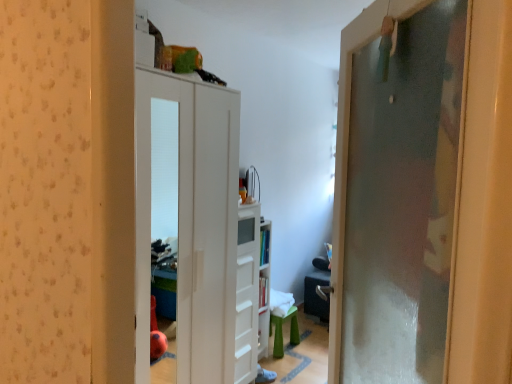
This screenshot has height=384, width=512. Identify the location of white matte cabinet at center, the second door in the front-to-back sequence. (191, 218).

Where is `frosted glass door at right, the 1th door in the right-to-left sequence`? The image size is (512, 384). frosted glass door at right, the 1th door in the right-to-left sequence is located at coordinates (397, 199).

Locate an element on the screen. white plastic bookshelf at center is located at coordinates (264, 288).

From the image's perspective, relative to green plastic stool at lower center, is white glossy dresser at center above or below?

white glossy dresser at center is above green plastic stool at lower center.

In the image, there is a white glossy dresser at center. Where is `furniture below it (from a real-world perspective)`? This screenshot has width=512, height=384. furniture below it (from a real-world perspective) is located at coordinates (282, 331).

Does point (238, 226) come behind point (290, 317)?

No, (238, 226) is in front of (290, 317).

Is white glossy dresser at center in contact with white matte cabinet at center, marked as the 1th door in a left-to-right arrangement?

white glossy dresser at center and white matte cabinet at center, marked as the 1th door in a left-to-right arrangement, are clearly separated.

Between white glossy dresser at center and white matte cabinet at center, the second door viewed from the right, which one has smaller width?

With smaller width is white glossy dresser at center.

Between white glossy dresser at center and white matte cabinet at center, marked as the 1th door in a left-to-right arrangement, which one has larger size?

white matte cabinet at center, marked as the 1th door in a left-to-right arrangement, is bigger.

Is white plastic bookshelf at center inside the boundaries of frosted glass door at right, the second door in the back-to-front sequence, or outside?

white plastic bookshelf at center is spatially situated outside frosted glass door at right, the second door in the back-to-front sequence.

Between white plastic bookshelf at center and frosted glass door at right, the 1th door in the right-to-left sequence, which one has less height?

white plastic bookshelf at center.

Consider the image. How different are the orientations of white plastic bookshelf at center and frosted glass door at right, the second door in the back-to-front sequence, in degrees?

The angular difference between white plastic bookshelf at center and frosted glass door at right, the second door in the back-to-front sequence, is 141 degrees.

Looking at this image, from the image's perspective, is white plastic bookshelf at center located above or below frosted glass door at right, the second door in the back-to-front sequence?

Clearly, from the image's perspective, white plastic bookshelf at center is below frosted glass door at right, the second door in the back-to-front sequence.

Considering the points (245, 284) and (264, 324), which point is behind, point (245, 284) or point (264, 324)?

Positioned behind is point (264, 324).

Can you confirm if white glossy dresser at center is positioned to the left of white plastic bookshelf at center?

Yes.

From a real-world perspective, which object stands above the other?

white glossy dresser at center.

Is white glossy dresser at center not close to white plastic bookshelf at center?

white glossy dresser at center is near white plastic bookshelf at center, not far away.

Can you tell me how much white plastic bookshelf at center and white matte cabinet at center, the second door in the front-to-back sequence, differ in facing direction?

The facing directions of white plastic bookshelf at center and white matte cabinet at center, the second door in the front-to-back sequence, are 1.25 degrees apart.

Considering the relative sizes of white plastic bookshelf at center and white matte cabinet at center, marked as the 1th door in a left-to-right arrangement, in the image provided, is white plastic bookshelf at center shorter than white matte cabinet at center, marked as the 1th door in a left-to-right arrangement,?

Yes.

Considering the relative sizes of white plastic bookshelf at center and white matte cabinet at center, marked as the 1th door in a left-to-right arrangement, in the image provided, is white plastic bookshelf at center wider than white matte cabinet at center, marked as the 1th door in a left-to-right arrangement,?

No, white plastic bookshelf at center is not wider than white matte cabinet at center, marked as the 1th door in a left-to-right arrangement.

Based on their sizes in the image, would you say green plastic stool at lower center is bigger or smaller than white matte cabinet at center, which ranks as the first door in back-to-front order?

Considering their sizes, green plastic stool at lower center takes up less space than white matte cabinet at center, which ranks as the first door in back-to-front order.

From the image's perspective, which object appears higher, green plastic stool at lower center or white matte cabinet at center, the second door viewed from the right?

From the image's view, white matte cabinet at center, the second door viewed from the right, is above.

Is green plastic stool at lower center wider than white matte cabinet at center, which ranks as the first door in back-to-front order?

In fact, green plastic stool at lower center might be narrower than white matte cabinet at center, which ranks as the first door in back-to-front order.

Who is taller, green plastic stool at lower center or white matte cabinet at center, marked as the 1th door in a left-to-right arrangement?

With more height is white matte cabinet at center, marked as the 1th door in a left-to-right arrangement.

From the image's perspective, which one is positioned lower, white matte cabinet at center, the second door in the front-to-back sequence, or white glossy dresser at center?

white glossy dresser at center appears lower in the image.

Is white glossy dresser at center at the back of white matte cabinet at center, marked as the 1th door in a left-to-right arrangement?

No, white glossy dresser at center is not at the back of white matte cabinet at center, marked as the 1th door in a left-to-right arrangement.

Considering the positions of points (180, 80) and (246, 354), is point (180, 80) farther from camera compared to point (246, 354)?

No, it is in front of (246, 354).

The height and width of the screenshot is (384, 512). Find the location of `dresser that is on the left side of green plastic stool at lower center`. dresser that is on the left side of green plastic stool at lower center is located at coordinates (248, 298).

The image size is (512, 384). There is a white glossy dresser at center. What are the coordinates of `the 1st door above it (from a real-world perspective)` in the screenshot? It's located at (191, 218).

Based on their spatial positions, is white glossy dresser at center or green plastic stool at lower center closer to frosted glass door at right, the 1th door in the right-to-left sequence?

The object closer to frosted glass door at right, the 1th door in the right-to-left sequence, is white glossy dresser at center.

Looking at the image, which one is located closer to white glossy dresser at center, green plastic stool at lower center or frosted glass door at right, the second door when ordered from left to right?

green plastic stool at lower center is positioned closer to the anchor white glossy dresser at center.

Based on their spatial positions, is white plastic bookshelf at center or green plastic stool at lower center closer to white glossy dresser at center?

Based on the image, white plastic bookshelf at center appears to be nearer to white glossy dresser at center.

Which object lies nearer to the anchor point frosted glass door at right, the second door in the back-to-front sequence, green plastic stool at lower center or white plastic bookshelf at center?

white plastic bookshelf at center is closer to frosted glass door at right, the second door in the back-to-front sequence.

Estimate the real-world distances between objects in this image. Which object is further from white plastic bookshelf at center, white matte cabinet at center, marked as the 1th door in a left-to-right arrangement, or green plastic stool at lower center?

white matte cabinet at center, marked as the 1th door in a left-to-right arrangement.

Looking at the image, which one is located closer to green plastic stool at lower center, white glossy dresser at center or white plastic bookshelf at center?

white plastic bookshelf at center lies closer to green plastic stool at lower center than the other object.

From the image, which object appears to be nearer to white plastic bookshelf at center, white matte cabinet at center, marked as the 1th door in a left-to-right arrangement, or white glossy dresser at center?

white glossy dresser at center.

Looking at this image, which object lies nearer to the anchor point white matte cabinet at center, the second door viewed from the right, frosted glass door at right, the second door when ordered from left to right, or white glossy dresser at center?

white glossy dresser at center is positioned closer to the anchor white matte cabinet at center, the second door viewed from the right.

The image size is (512, 384). Identify the location of shelf located between frosted glass door at right, the 1th door in the right-to-left sequence, and green plastic stool at lower center in the depth direction. (264, 288).

Where is `dresser between frosted glass door at right, arranged as the 1th door when viewed from the front, and green plastic stool at lower center, along the z-axis`? dresser between frosted glass door at right, arranged as the 1th door when viewed from the front, and green plastic stool at lower center, along the z-axis is located at coordinates 248,298.

What are the coordinates of `shelf between white glossy dresser at center and green plastic stool at lower center from front to back` in the screenshot? It's located at (264, 288).

The width and height of the screenshot is (512, 384). Identify the location of dresser between white matte cabinet at center, the second door in the front-to-back sequence, and white plastic bookshelf at center from front to back. (248, 298).